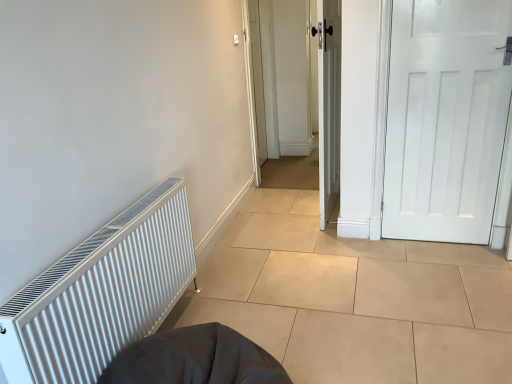
The image size is (512, 384). Identify the location of free space in front of white matte door at right, arranged as the 1th door when viewed from the right. (451, 267).